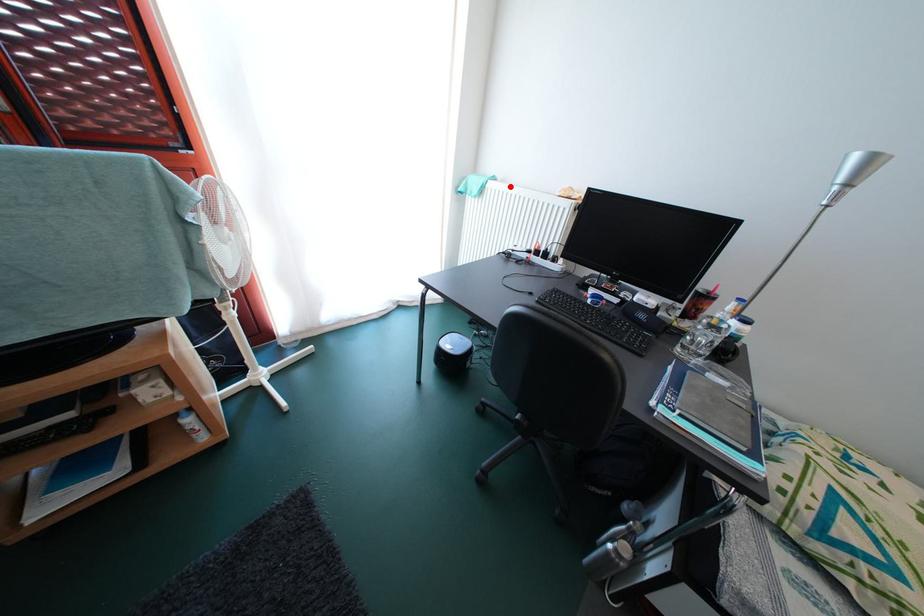
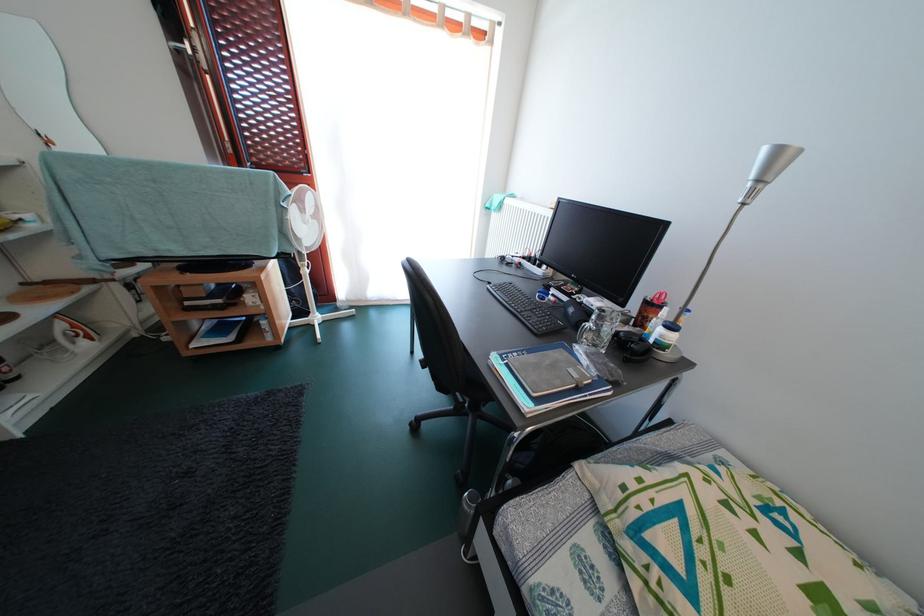
Question: I am providing you with two images of the same scene from different viewpoints. A red point is marked on the first image. At the location where the point appears in image 1, is it still visible in image 2?

Choices:
 (A) Yes
 (B) No

Answer: (A)